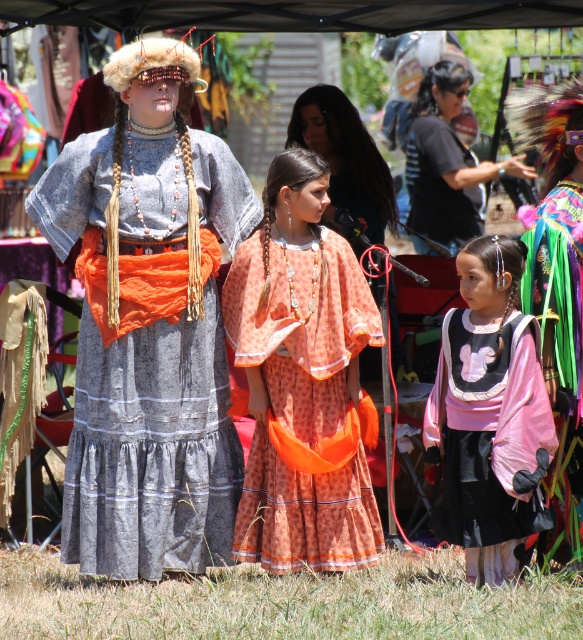
Question: Can you confirm if velvet pink dress at center is positioned above matte black shirt at upper center?

Choices:
 (A) yes
 (B) no

Answer: (B)

Question: Where is matte gray dress at center located in relation to velvet pink dress at center in the image?

Choices:
 (A) below
 (B) above

Answer: (B)

Question: Which object is closer to the camera taking this photo?

Choices:
 (A) orange fabric dress at center
 (B) matte black shirt at upper center
 (C) black cotton shirt at upper center

Answer: (A)

Question: Can you confirm if multicolored feather headdress at upper right is thinner than black cotton shirt at upper center?

Choices:
 (A) no
 (B) yes

Answer: (B)

Question: Considering the real-world distances, which object is closest to the orange printed dress at center?

Choices:
 (A) velvet pink dress at center
 (B) matte black shirt at upper center

Answer: (A)

Question: Which point appears farthest from the camera in this image?

Choices:
 (A) (314, 566)
 (B) (378, 157)
 (C) (455, 205)
 (D) (560, 554)

Answer: (C)